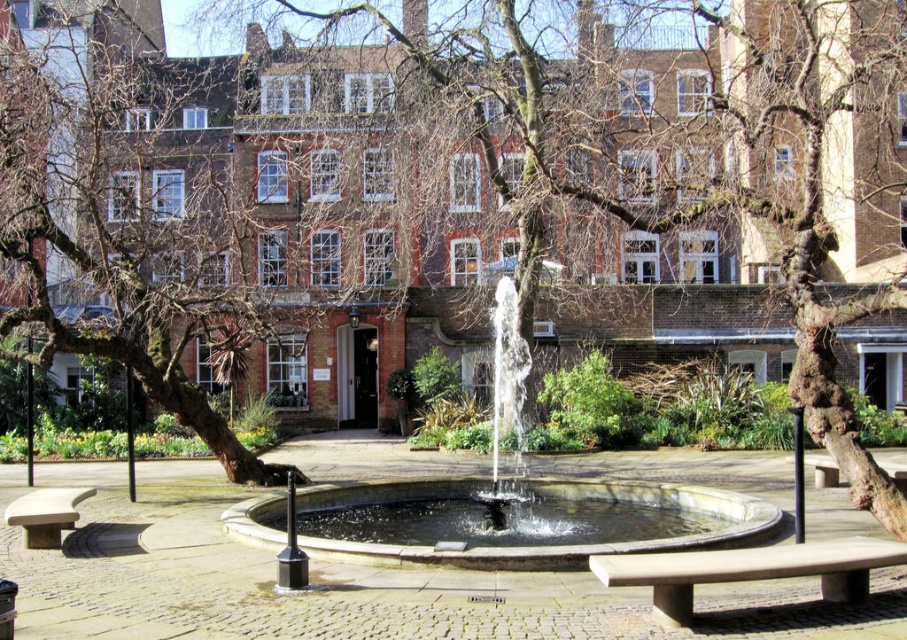
Can you confirm if smooth concrete bench at lower right is taller than smooth stone bench at lower left?

No, smooth concrete bench at lower right is not taller than smooth stone bench at lower left.

Is smooth concrete bench at lower right positioned behind smooth stone bench at lower left?

No, smooth concrete bench at lower right is closer to the viewer.

Measure the distance between point (768, 552) and camera.

They are 48.74 feet apart.

The height and width of the screenshot is (640, 907). In order to click on smooth concrete bench at lower right in this screenshot , I will do `click(748, 570)`.

Is brown bark tree at left smaller than smooth concrete bench at lower right?

No.

Who is lower down, brown bark tree at left or smooth concrete bench at lower right?

A: Positioned lower is smooth concrete bench at lower right.

The image size is (907, 640). Describe the element at coordinates (127, 220) in the screenshot. I see `brown bark tree at left` at that location.

The width and height of the screenshot is (907, 640). What are the coordinates of `brown bark tree at left` in the screenshot? It's located at [127, 220].

Is the position of brown bark tree at left more distant than that of smooth stone fountain at center?

Yes.

Is point (210, 193) positioned after point (520, 433)?

Yes.

Identify the location of brown bark tree at left. This screenshot has width=907, height=640. (127, 220).